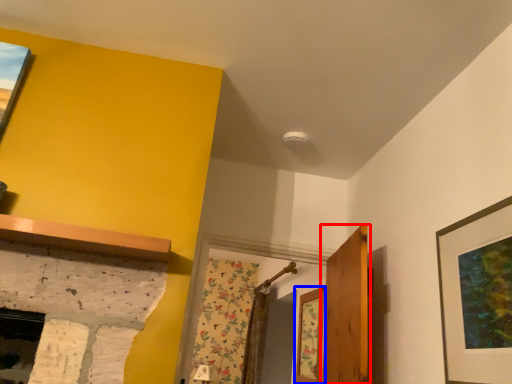
Question: Which of the following is the closest to the observer, door (highlighted by a red box) or window (highlighted by a blue box)?

Choices:
 (A) door
 (B) window

Answer: (A)